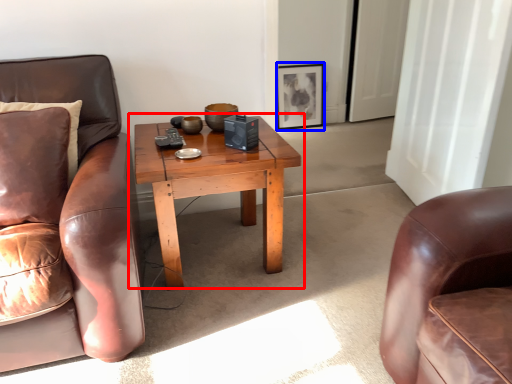
Question: Which object is closer to the camera taking this photo, coffee table (highlighted by a red box) or picture frame (highlighted by a blue box)?

Choices:
 (A) coffee table
 (B) picture frame

Answer: (A)